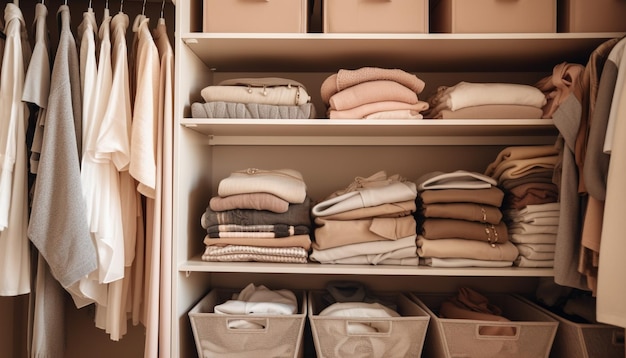
Locate an element on the screen. This screenshot has width=626, height=358. clothes on hangers on the left is located at coordinates (11, 44), (42, 56), (64, 53), (91, 51), (103, 52), (120, 68), (148, 63), (172, 66).